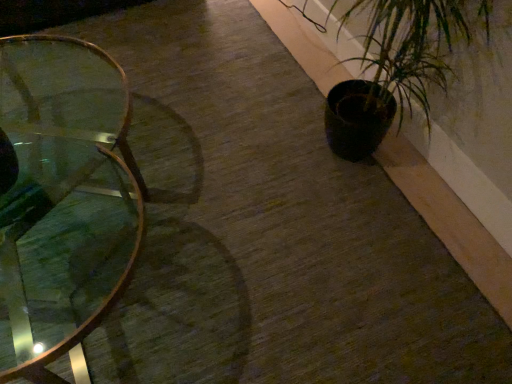
In order to face dark matte pot at right, should I rotate leftwards or rightwards?

You should look right and rotate roughly 17.613 degrees.

The height and width of the screenshot is (384, 512). What do you see at coordinates (408, 47) in the screenshot? I see `dark matte pot at right` at bounding box center [408, 47].

Locate an element on the screen. The height and width of the screenshot is (384, 512). dark matte pot at right is located at coordinates (408, 47).

Measure the distance between dark matte pot at right and camera.

The distance of dark matte pot at right from camera is 3.63 feet.

Locate an element on the screen. This screenshot has width=512, height=384. clear glass table at left is located at coordinates (63, 201).

Describe the element at coordinates (63, 201) in the screenshot. This screenshot has width=512, height=384. I see `clear glass table at left` at that location.

Identify the location of dark matte pot at right. This screenshot has width=512, height=384. (408, 47).

Considering the positions of objects dark matte pot at right and clear glass table at left in the image provided, who is more to the left, dark matte pot at right or clear glass table at left?

clear glass table at left.

Does dark matte pot at right lie in front of clear glass table at left?

No, it is not.

Which is closer to the camera, (375, 18) or (65, 47)?

The point (375, 18) is in front.

From the image's perspective, is dark matte pot at right above or below clear glass table at left?

Based on their image positions, dark matte pot at right is located above clear glass table at left.

From a real-world perspective, which is physically below, dark matte pot at right or clear glass table at left?

clear glass table at left.

Which of these two, dark matte pot at right or clear glass table at left, is thinner?

dark matte pot at right is thinner.

Which of these two, dark matte pot at right or clear glass table at left, stands taller?

dark matte pot at right.

Is dark matte pot at right bigger than clear glass table at left?

No.

Is dark matte pot at right located outside clear glass table at left?

dark matte pot at right lies outside clear glass table at left's area.

Is dark matte pot at right beside clear glass table at left?

No, dark matte pot at right is not next to clear glass table at left.

Is dark matte pot at right positioned with its back to clear glass table at left?

dark matte pot at right is not turned away from clear glass table at left.

How distant is dark matte pot at right from clear glass table at left?

dark matte pot at right is 3.43 feet from clear glass table at left.

The width and height of the screenshot is (512, 384). In the image, there is a dark matte pot at right. In order to click on table below it (from the image's perspective) in this screenshot , I will do `click(63, 201)`.

From the picture: Is clear glass table at left at the right side of dark matte pot at right?

No.

Between clear glass table at left and dark matte pot at right, which one is positioned behind?

dark matte pot at right is behind.

Considering the positions of point (94, 57) and point (375, 85), is point (94, 57) closer or farther from the camera than point (375, 85)?

Point (94, 57) is farther from the camera than point (375, 85).

From the image's perspective, is clear glass table at left beneath dark matte pot at right?

Yes, from the image's perspective, clear glass table at left is beneath dark matte pot at right.

From a real-world perspective, is clear glass table at left on dark matte pot at right?

No.

Looking at their sizes, would you say clear glass table at left is wider or thinner than dark matte pot at right?

Considering their sizes, clear glass table at left looks broader than dark matte pot at right.

Is clear glass table at left taller or shorter than dark matte pot at right?

In the image, clear glass table at left appears to be shorter than dark matte pot at right.

From the picture: Considering the sizes of objects clear glass table at left and dark matte pot at right in the image provided, who is bigger, clear glass table at left or dark matte pot at right?

With larger size is clear glass table at left.

Do you think clear glass table at left is within dark matte pot at right, or outside of it?

clear glass table at left lies outside dark matte pot at right.

Is clear glass table at left far away from dark matte pot at right?

Indeed, clear glass table at left is not near dark matte pot at right.

Is dark matte pot at right at the back of clear glass table at left?

Correct, clear glass table at left is looking away from dark matte pot at right.

How many degrees apart are the facing directions of clear glass table at left and dark matte pot at right?

The angle between the facing direction of clear glass table at left and the facing direction of dark matte pot at right is 0.0014 degrees.

Measure the distance between clear glass table at left and dark matte pot at right.

The distance of clear glass table at left from dark matte pot at right is 1.05 meters.

At what (x,y) coordinates should I click in order to perform the action: click on table located on the left of dark matte pot at right. Please return your answer as a coordinate pair (x, y). Image resolution: width=512 pixels, height=384 pixels. Looking at the image, I should click on (63, 201).

This screenshot has width=512, height=384. In order to click on houseplant above the clear glass table at left (from a real-world perspective) in this screenshot , I will do `click(408, 47)`.

At what (x,y) coordinates should I click in order to perform the action: click on table that appears on the left of dark matte pot at right. Please return your answer as a coordinate pair (x, y). The width and height of the screenshot is (512, 384). Looking at the image, I should click on (63, 201).